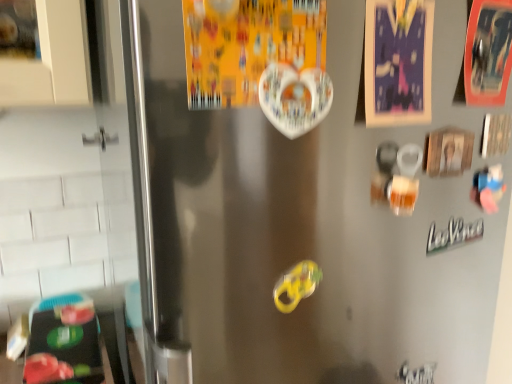
Question: Based on their positions, is orange cardboard postcard at upper right, the 1th postcard in the right-to-left sequence, located to the left or right of matte paper postcard at upper right, placed as the 2th postcard when sorted from right to left?

Choices:
 (A) left
 (B) right

Answer: (B)

Question: Is orange cardboard postcard at upper right, the 1th postcard in the right-to-left sequence, situated inside matte paper postcard at upper right, which is the 2th postcard in left-to-right order, or outside?

Choices:
 (A) outside
 (B) inside

Answer: (A)

Question: Estimate the real-world distances between objects in this image. Which object is closer to the matte paper postcard at upper right, placed as the 2th postcard when sorted from right to left?

Choices:
 (A) white glossy heart at upper center, marked as the first postcard in a left-to-right arrangement
 (B) green metallic sticker at lower right
 (C) orange cardboard postcard at upper right, which is the 3th postcard from left to right
 (D) yellow rubber band at center

Answer: (A)

Question: Estimate the real-world distances between objects in this image. Which object is closer to the green metallic sticker at lower right?

Choices:
 (A) yellow rubber band at center
 (B) white glossy heart at upper center, marked as the first postcard in a left-to-right arrangement
 (C) orange cardboard postcard at upper right, the 1th postcard in the right-to-left sequence
 (D) matte paper postcard at upper right, placed as the 2th postcard when sorted from right to left

Answer: (C)